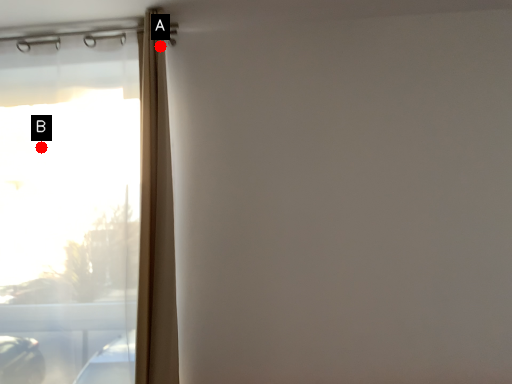
Question: Two points are circled on the image, labeled by A and B beside each circle. Among these points, which one is farthest from the camera?

Choices:
 (A) A is further
 (B) B is further

Answer: (B)